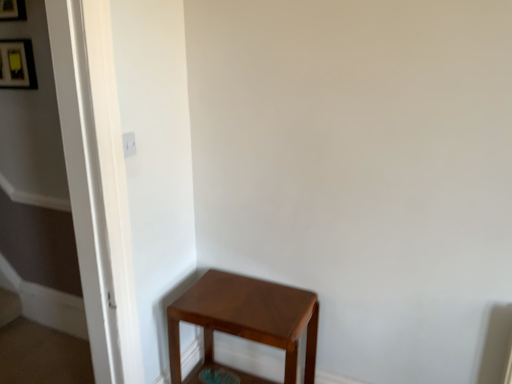
Question: Would you consider matte black picture frame at upper left, arranged as the 2th picture frame when viewed from the top, to be distant from matte black picture frame at upper left, the first picture frame positioned from the top?

Choices:
 (A) no
 (B) yes

Answer: (A)

Question: Is matte black picture frame at upper left, marked as the first picture frame in a bottom-to-top arrangement, facing towards matte black picture frame at upper left, the first picture frame positioned from the top?

Choices:
 (A) no
 (B) yes

Answer: (A)

Question: Is matte black picture frame at upper left, marked as the first picture frame in a bottom-to-top arrangement, in front of matte black picture frame at upper left, the first picture frame positioned from the top?

Choices:
 (A) yes
 (B) no

Answer: (B)

Question: Is matte black picture frame at upper left, the first picture frame positioned from the top, inside matte black picture frame at upper left, marked as the first picture frame in a bottom-to-top arrangement?

Choices:
 (A) no
 (B) yes

Answer: (A)

Question: Is matte black picture frame at upper left, marked as the first picture frame in a bottom-to-top arrangement, smaller than matte black picture frame at upper left, the first picture frame positioned from the top?

Choices:
 (A) yes
 (B) no

Answer: (A)

Question: From a real-world perspective, is matte black picture frame at upper left, marked as the first picture frame in a bottom-to-top arrangement, positioned above or below matte black picture frame at upper left, positioned as the 2th picture frame in bottom-to-top order?

Choices:
 (A) above
 (B) below

Answer: (B)

Question: Is matte black picture frame at upper left, arranged as the 2th picture frame when viewed from the top, in front of or behind matte black picture frame at upper left, the first picture frame positioned from the top, in the image?

Choices:
 (A) front
 (B) behind

Answer: (B)

Question: Is matte black picture frame at upper left, marked as the first picture frame in a bottom-to-top arrangement, inside or outside of matte black picture frame at upper left, the first picture frame positioned from the top?

Choices:
 (A) outside
 (B) inside

Answer: (A)

Question: Based on their sizes in the image, would you say matte black picture frame at upper left, marked as the first picture frame in a bottom-to-top arrangement, is bigger or smaller than matte black picture frame at upper left, the first picture frame positioned from the top?

Choices:
 (A) small
 (B) big

Answer: (A)

Question: In terms of size, does matte black picture frame at upper left, the first picture frame positioned from the top, appear bigger or smaller than matte black picture frame at upper left, arranged as the 2th picture frame when viewed from the top?

Choices:
 (A) small
 (B) big

Answer: (B)

Question: Considering the positions of point (9, 18) and point (32, 61), is point (9, 18) closer or farther from the camera than point (32, 61)?

Choices:
 (A) farther
 (B) closer

Answer: (B)

Question: From the image's perspective, is matte black picture frame at upper left, the first picture frame positioned from the top, located above or below matte black picture frame at upper left, arranged as the 2th picture frame when viewed from the top?

Choices:
 (A) below
 (B) above

Answer: (B)

Question: From a real-world perspective, is matte black picture frame at upper left, the first picture frame positioned from the top, above or below matte black picture frame at upper left, arranged as the 2th picture frame when viewed from the top?

Choices:
 (A) above
 (B) below

Answer: (A)

Question: From a real-world perspective, is matte black picture frame at upper left, arranged as the 2th picture frame when viewed from the top, physically located above or below matte brown stool at lower right?

Choices:
 (A) above
 (B) below

Answer: (A)

Question: Is point (27, 64) closer or farther from the camera than point (313, 319)?

Choices:
 (A) farther
 (B) closer

Answer: (A)